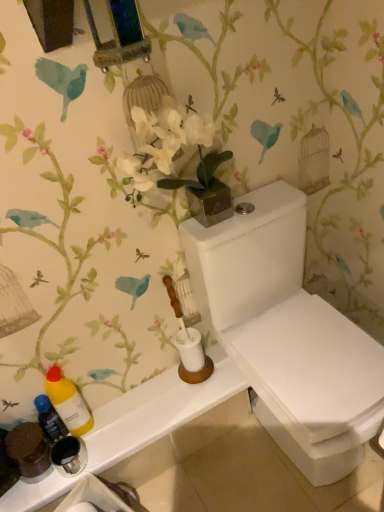
This screenshot has height=512, width=384. What are the coordinates of `vacant space to the right of yellow matte bottle at lower left, which is the second bottle from left to right` in the screenshot? It's located at (133, 413).